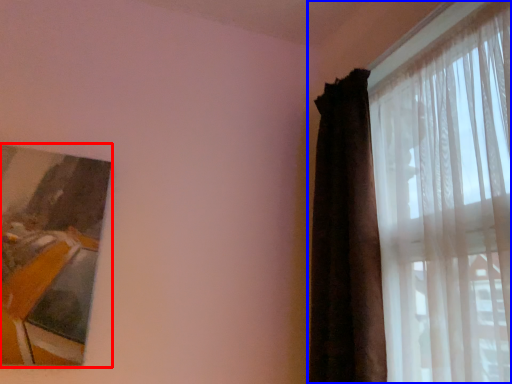
Question: Which point is further to the camera, picture frame (highlighted by a red box) or curtain (highlighted by a blue box)?

Choices:
 (A) picture frame
 (B) curtain

Answer: (A)